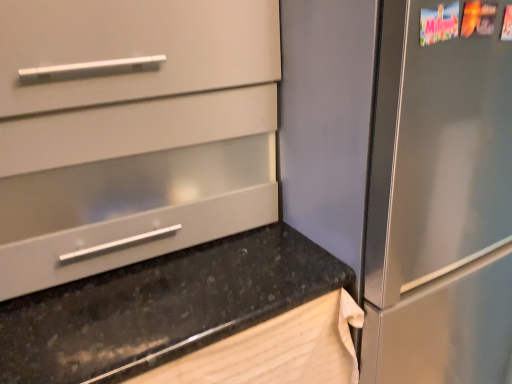
Question: From a real-world perspective, is matte white drawer at center located higher than black granite countertop at lower left?

Choices:
 (A) yes
 (B) no

Answer: (A)

Question: Is matte white drawer at center wider than black granite countertop at lower left?

Choices:
 (A) yes
 (B) no

Answer: (B)

Question: Does matte white drawer at center touch black granite countertop at lower left?

Choices:
 (A) no
 (B) yes

Answer: (A)

Question: Can you confirm if matte white drawer at center is thinner than black granite countertop at lower left?

Choices:
 (A) no
 (B) yes

Answer: (B)

Question: Does matte white drawer at center have a lesser height compared to black granite countertop at lower left?

Choices:
 (A) yes
 (B) no

Answer: (A)

Question: Would you say matte white drawer at center is outside black granite countertop at lower left?

Choices:
 (A) yes
 (B) no

Answer: (A)

Question: Could matte white drawer at center be considered to be inside black granite countertop at lower left?

Choices:
 (A) yes
 (B) no

Answer: (B)

Question: Is black granite countertop at lower left located outside matte white drawer at center?

Choices:
 (A) yes
 (B) no

Answer: (A)

Question: Is black granite countertop at lower left facing away from matte white drawer at center?

Choices:
 (A) no
 (B) yes

Answer: (A)

Question: Is black granite countertop at lower left thinner than matte white drawer at center?

Choices:
 (A) no
 (B) yes

Answer: (A)

Question: Is black granite countertop at lower left smaller than matte white drawer at center?

Choices:
 (A) no
 (B) yes

Answer: (A)

Question: Does black granite countertop at lower left lie behind matte white drawer at center?

Choices:
 (A) yes
 (B) no

Answer: (B)

Question: Visually, is matte white drawer at center positioned to the left or to the right of black granite countertop at lower left?

Choices:
 (A) right
 (B) left

Answer: (B)